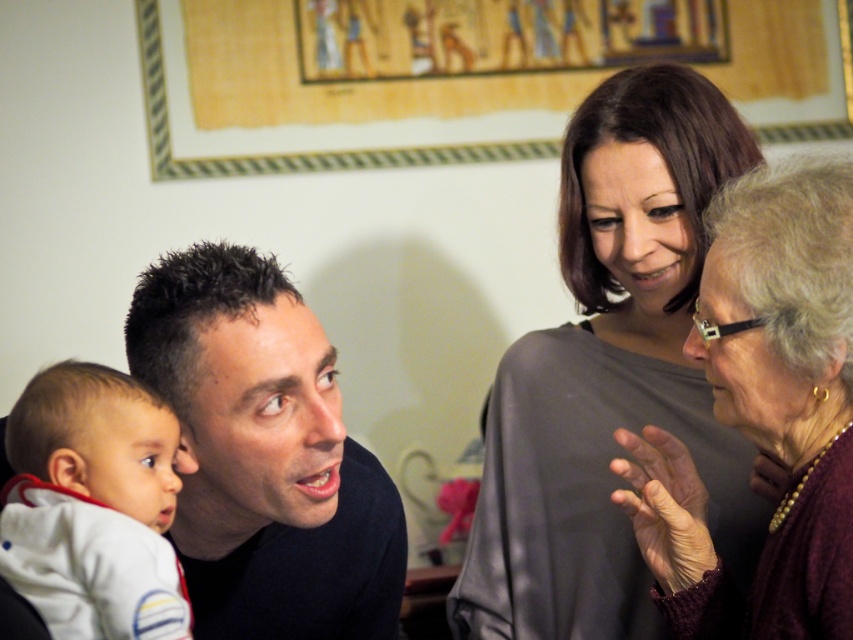
In the living room scene, there are two adults wearing a smooth gray blouse at upper right and a dark blue shirt at left. Which clothing item takes up more visual space in the image?

The dark blue shirt at left takes up more visual space than the smooth gray blouse at upper right because the smooth gray blouse at upper right occupies less space than dark blue shirt at left.

Where is the dark blue shirt at left located in the image?

The dark blue shirt at left is located at point 0.713 on the x axis and 0.312 on the y axis.

You are a photographer trying to capture a group photo of the dark blue shirt at left and the white soft fabric baby at lower left. If you want to ensure both subjects are in focus, which one should you adjust your camera focus on first?

The dark blue shirt at left is wider than the white soft fabric baby at lower left, so you should focus on the dark blue shirt at left first to ensure both are in focus.